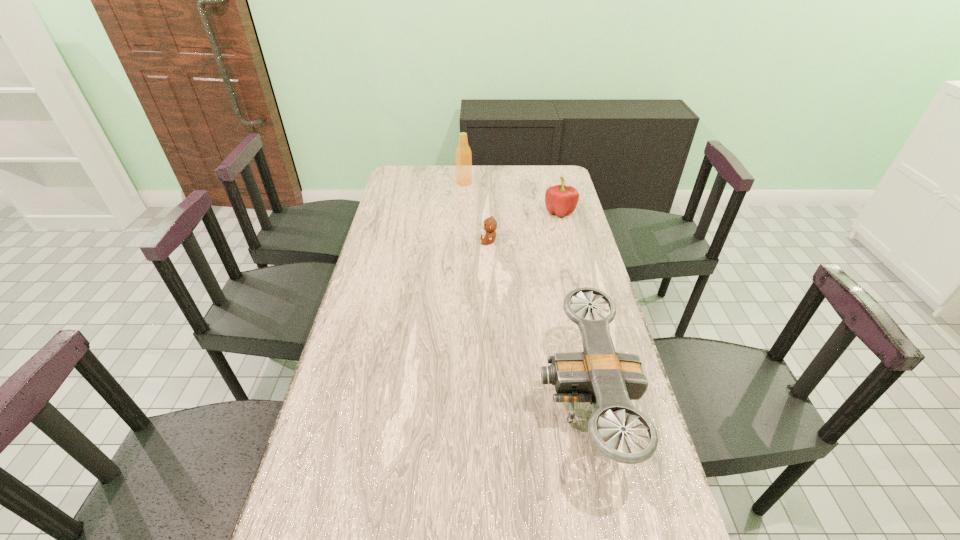
Find the location of `beer bottle`. beer bottle is located at coordinates (463, 156).

I want to click on the tallest object, so click(463, 156).

The width and height of the screenshot is (960, 540). Identify the location of the nearest object. (609, 380).

Identify the location of the third shortest object. (609, 380).

Identify the location of the third nearest object. (560, 199).

Where is `bell pepper`? This screenshot has width=960, height=540. bell pepper is located at coordinates (560, 199).

Identify the location of the shortest object. (489, 225).

At what (x,y) coordinates should I click in order to perform the action: click on the second nearest object. Please return your answer as a coordinate pair (x, y). This screenshot has height=540, width=960. Looking at the image, I should click on (489, 225).

Locate an element on the screen. This screenshot has width=960, height=540. vacant position located on the left of the farthest object is located at coordinates (408, 183).

This screenshot has width=960, height=540. Find the location of `vacant region located 0.180m on the front-facing side of the nearest object`. vacant region located 0.180m on the front-facing side of the nearest object is located at coordinates (468, 402).